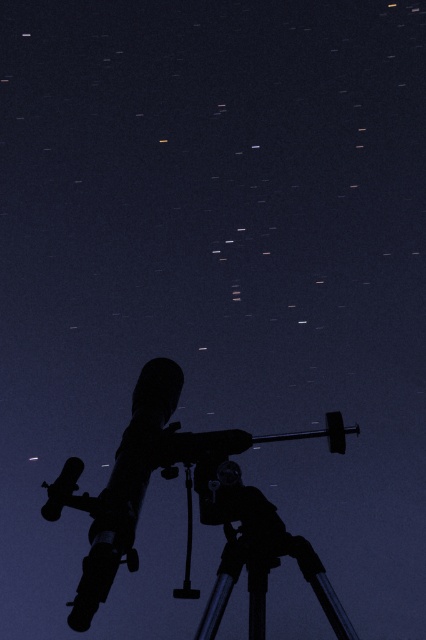
Based on the photo, which of these two, silhouette figure at center or metallic telescope at center, stands shorter?

metallic telescope at center

Is point (118, 468) less distant than point (213, 436)?

Yes, point (118, 468) is in front of point (213, 436).

Identify the location of silhouette figure at center. (126, 486).

How distant is silhouette figure at center from metallic silver tripod at lower center?

They are 7.60 inches apart.

Is silhouette figure at center positioned behind metallic silver tripod at lower center?

No, silhouette figure at center is in front of metallic silver tripod at lower center.

Does point (108, 490) lie behind point (212, 593)?

That is True.

Where is `silhouette figure at center`? This screenshot has height=640, width=426. silhouette figure at center is located at coordinates (126, 486).

Is point (288, 436) closer to camera compared to point (296, 560)?

No, (288, 436) is further to viewer.

Measure the distance between point (149, 435) and camera.

Point (149, 435) is 1.97 meters from camera.

Image resolution: width=426 pixels, height=640 pixels. What do you see at coordinates (195, 451) in the screenshot? I see `metallic telescope at center` at bounding box center [195, 451].

The image size is (426, 640). Identify the location of metallic telescope at center. (x=195, y=451).